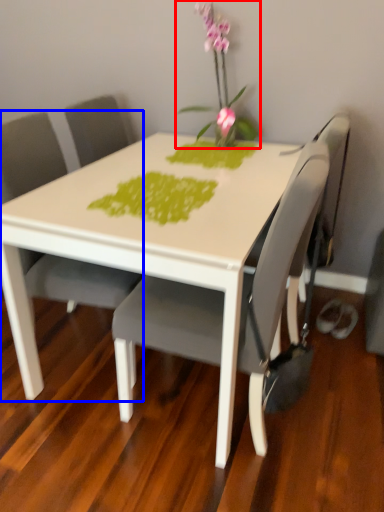
Question: Which object is further to the camera taking this photo, houseplant (highlighted by a red box) or chair (highlighted by a blue box)?

Choices:
 (A) houseplant
 (B) chair

Answer: (A)